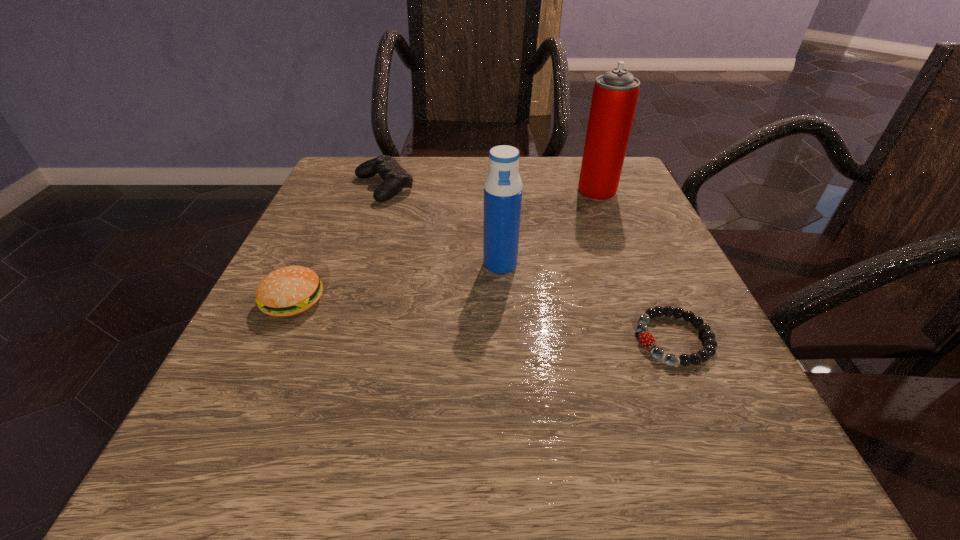
Locate an element on the screen. This screenshot has height=540, width=960. vacant area that lies between the patty and the tallest object is located at coordinates (445, 246).

Identify the location of free space between the control and the patty. This screenshot has width=960, height=540. (339, 244).

Locate an element on the screen. The width and height of the screenshot is (960, 540). free area in between the bracelet and the aerosol can is located at coordinates (636, 265).

You are a GUI agent. You are given a task and a screenshot of the screen. Output one action in this format:
    pyautogui.click(x=<x>, y=<y>)
    Task: Click on the free area in between the tallest object and the patty
    
    Given the screenshot: What is the action you would take?
    pyautogui.click(x=445, y=246)

Select which object appears as the fourth closest to the fourth shortest object. Please provide its 2D coordinates. Your answer should be formatted as a tuple, i.e. [(x, y)], where the tuple contains the x and y coordinates of a point satisfying the conditions above.

[(287, 291)]

Identify the location of object that is the third closest to the fourth shortest object. This screenshot has height=540, width=960. (615, 94).

Where is `free spot that satisfies the following two spatial constraints: 1. on the front side of the bracelet; 2. on the left side of the water bottle`? The image size is (960, 540). free spot that satisfies the following two spatial constraints: 1. on the front side of the bracelet; 2. on the left side of the water bottle is located at coordinates (504, 339).

Where is `blank area in the image that satisfies the following two spatial constraints: 1. on the back side of the patty; 2. on the left side of the control`? blank area in the image that satisfies the following two spatial constraints: 1. on the back side of the patty; 2. on the left side of the control is located at coordinates (346, 187).